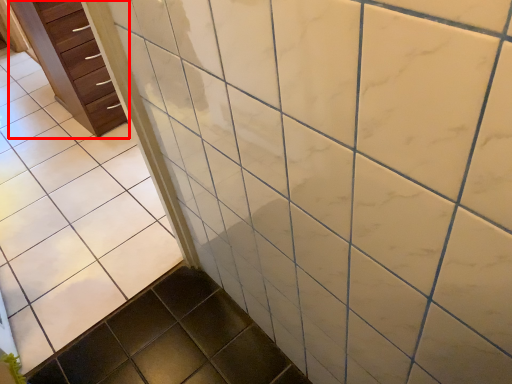
Question: Observing the image, what is the correct spatial positioning of chest of drawers (annotated by the red box) in reference to ceramic tile?

Choices:
 (A) right
 (B) left

Answer: (B)